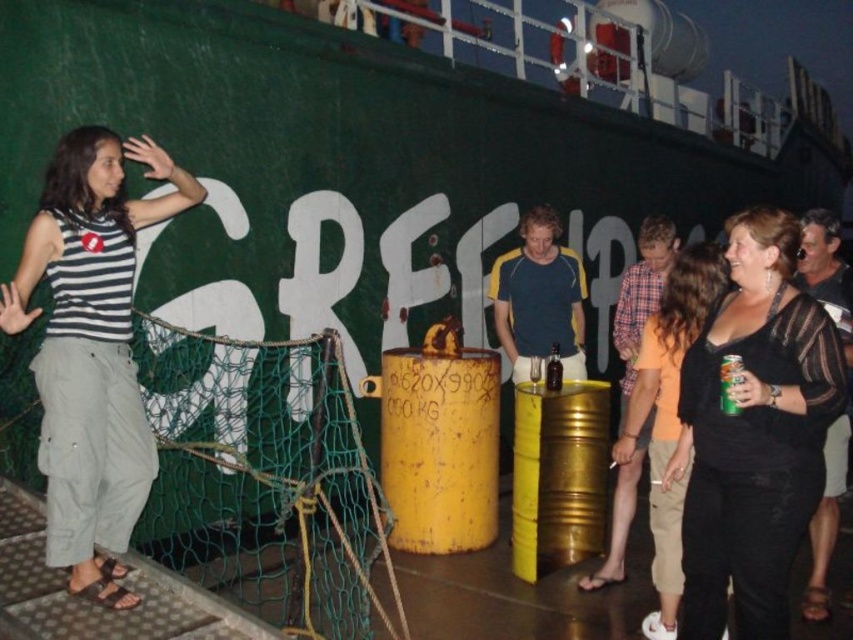
You are a photographer on the ship deck at night. You want to take a photo of the green mesh net at center and the black sheer top at center. Which object should you focus on first if you want to capture both in the same frame without moving the camera?

The green mesh net at center is larger in size than the black sheer top at center, so focusing on the larger object first might ensure it occupies the frame appropriately, but since both need to be in the same frame, you should adjust the camera to include both by considering their sizes and positions.